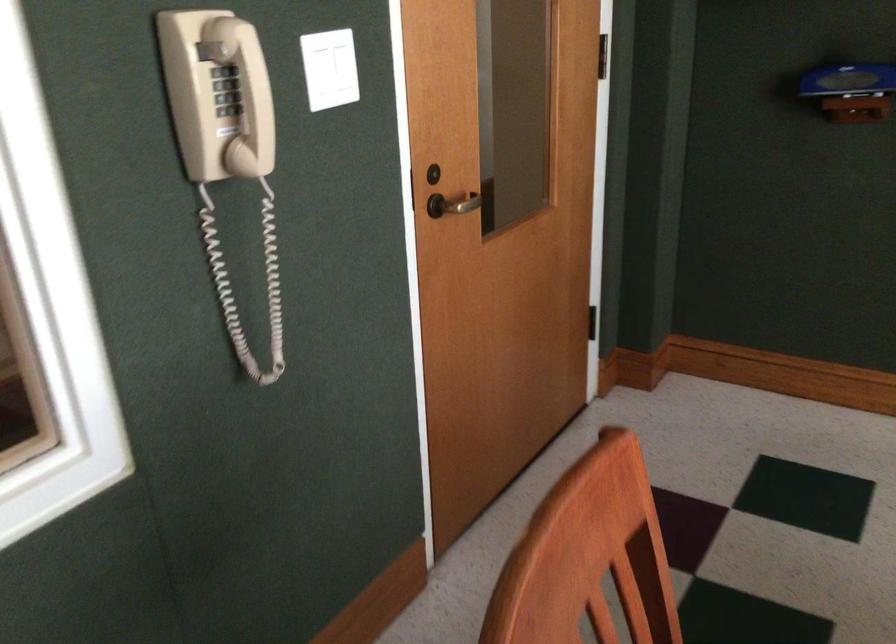
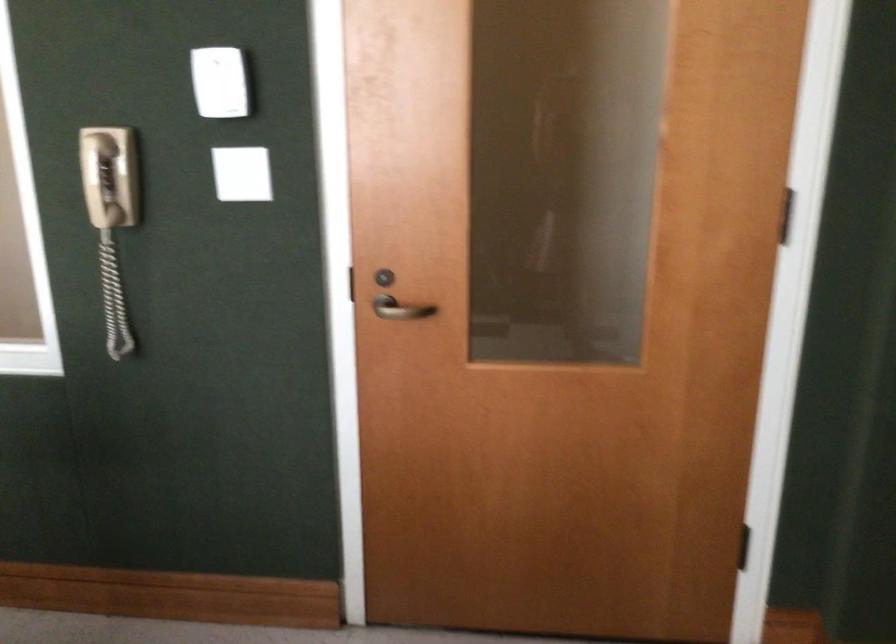
Find the pixel in the second image that matches (403,183) in the first image.

(346, 283)